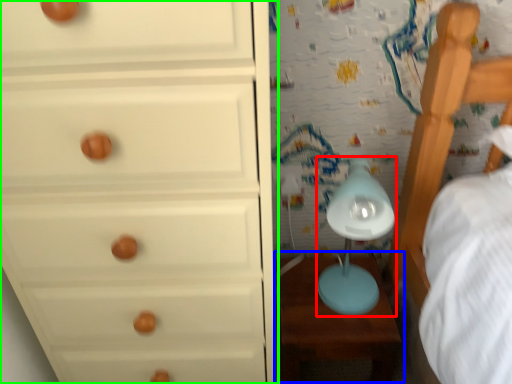
Question: Estimate the real-world distances between objects in this image. Which object is closer to table lamp (highlighted by a red box), table (highlighted by a blue box) or chest of drawers (highlighted by a green box)?

Choices:
 (A) table
 (B) chest of drawers

Answer: (A)